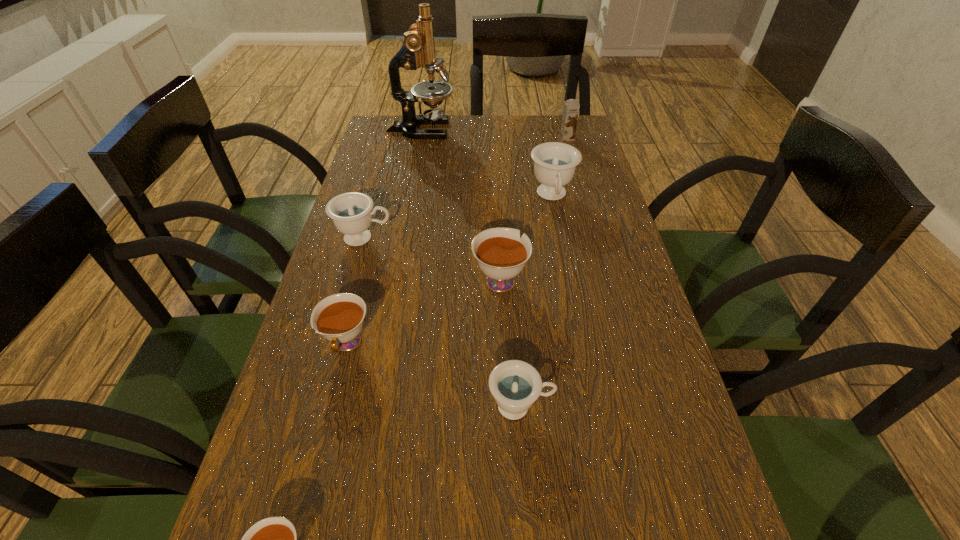
Identify the location of vacant space at the left edge of the desktop. Image resolution: width=960 pixels, height=540 pixels. (374, 351).

You are a GUI agent. You are given a task and a screenshot of the screen. Output one action in this format:
    pyautogui.click(x=<x>, y=<y>)
    Task: Click on the free region at the right edge of the desktop
    This screenshot has height=540, width=960.
    Given the screenshot: What is the action you would take?
    pyautogui.click(x=668, y=454)

The image size is (960, 540). In order to click on free space at the far right corner in this screenshot , I will do `click(588, 147)`.

The height and width of the screenshot is (540, 960). Find the location of `free point between the sixth farthest object and the farthest blue teacup`. free point between the sixth farthest object and the farthest blue teacup is located at coordinates (449, 270).

Identify the location of empty location between the rightmost blue teacup and the microscope. This screenshot has width=960, height=540. (487, 163).

Identify the location of vacant space in between the second biggest blue teacup and the chocolate milk. (466, 188).

Identify the location of vacant area that lies between the nearest blue teacup and the fourth farthest teacup. The width and height of the screenshot is (960, 540). (434, 375).

You are a GUI agent. You are given a task and a screenshot of the screen. Output one action in this format:
    pyautogui.click(x=<x>, y=<y>)
    Task: Click on the unoccupied area between the second nearest object and the chocolate milk
    
    Given the screenshot: What is the action you would take?
    pyautogui.click(x=543, y=272)

Locate an element on the screen. empty space between the fourth nearest teacup and the microscope is located at coordinates (461, 205).

Select which object is the sixth closest to the fifth nearest object. Please provide its 2D coordinates. Your answer should be formatted as a tuple, i.e. [(x, y)], where the tuple contains the x and y coordinates of a point satisfying the conditions above.

[(274, 539)]